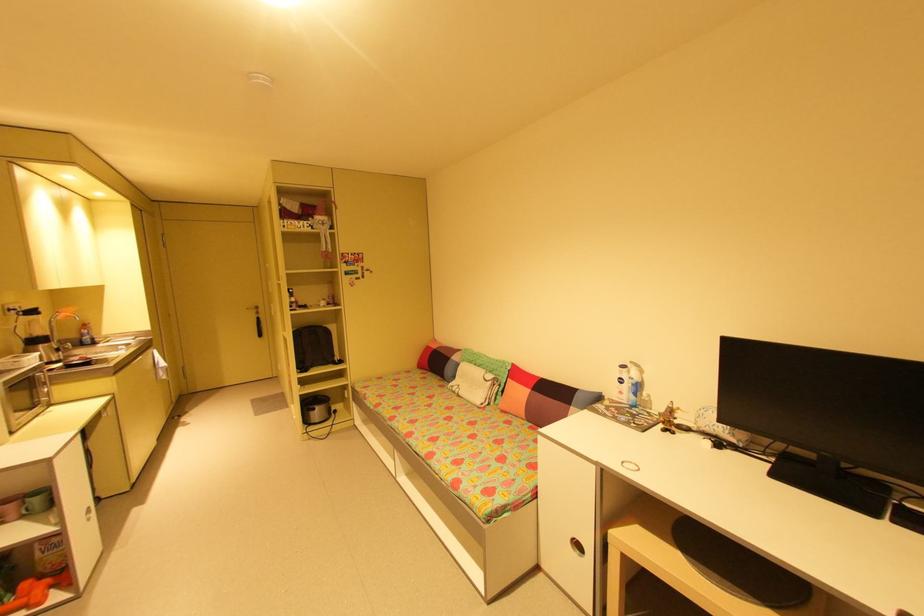
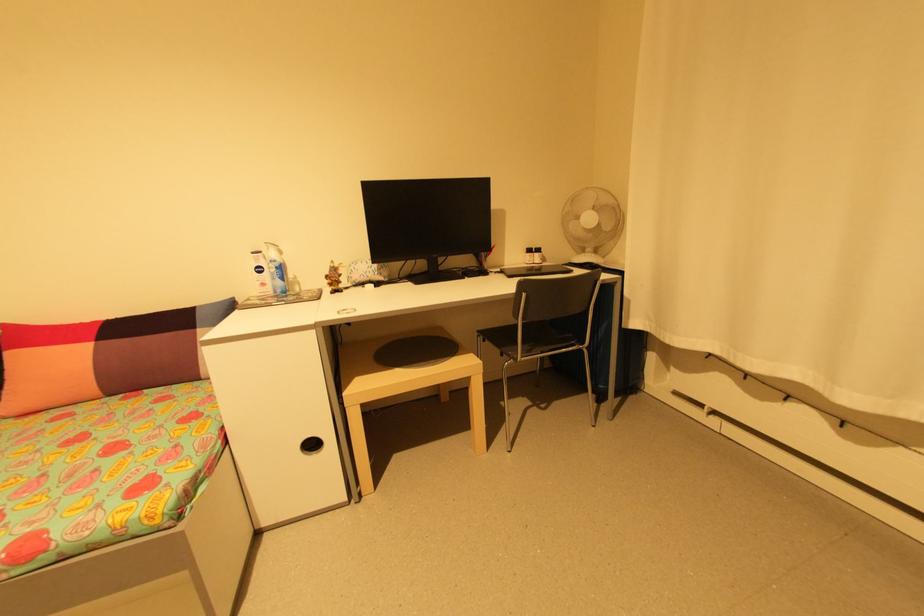
Question: I am providing you with two images of the same scene from different viewpoints. Which of the following objects are not visible in image2?

Choices:
 (A) closed black laptop
 (B) radiator handle
 (C) white fan button
 (D) none of these

Answer: (D)